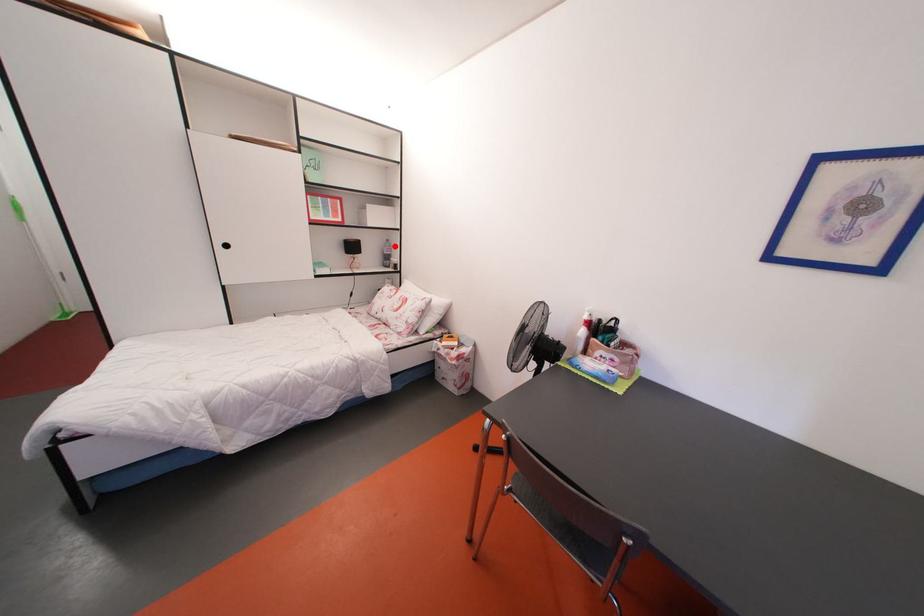
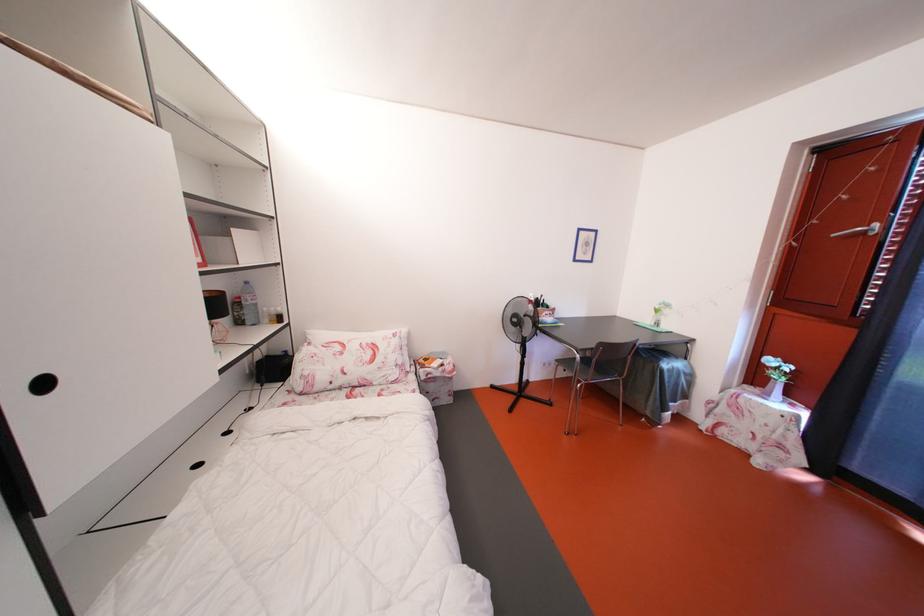
Where in the second image is the point corresponding to the highlighted location from the first image?

(253, 288)